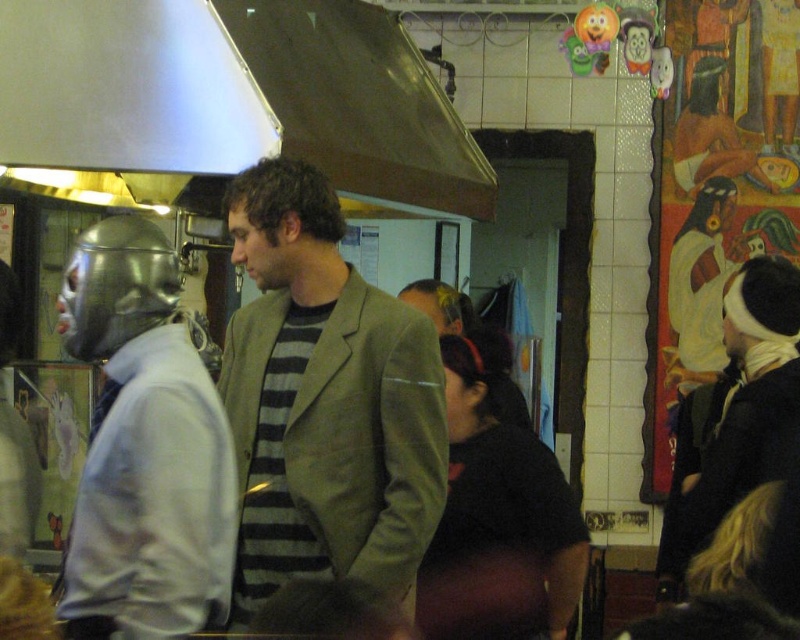
From the picture: You are a customer in this restaurant and you want to point out the metallic silver helmet at left and the metallic silver exhaust hood at upper center to a friend. Which one is located to the left side of the other?

The metallic silver helmet at left is to the left of the metallic silver exhaust hood at upper center.

You are a delivery person entering the restaurant and need to place a new metallic silver helmet at left on the counter. The counter has a metallic silver exhaust hood at upper left above it. Can the helmet fit under the exhaust hood without needing to adjust its position?

The metallic silver helmet at left has a lesser width compared to the metallic silver exhaust hood at upper left, so it can fit under the exhaust hood without needing to adjust its position.